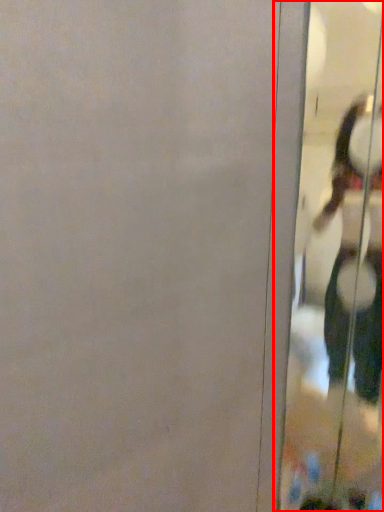
Question: Where is screen door (annotated by the red box) located in relation to person in the image?

Choices:
 (A) right
 (B) left

Answer: (B)